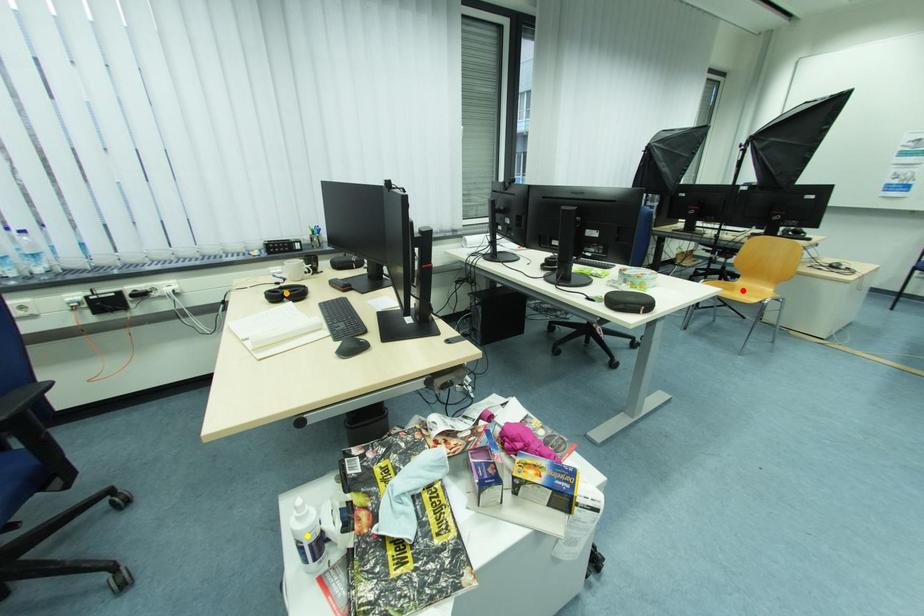
Order these from nearest to farthest:
yellow point | orange point | red point

1. yellow point
2. orange point
3. red point